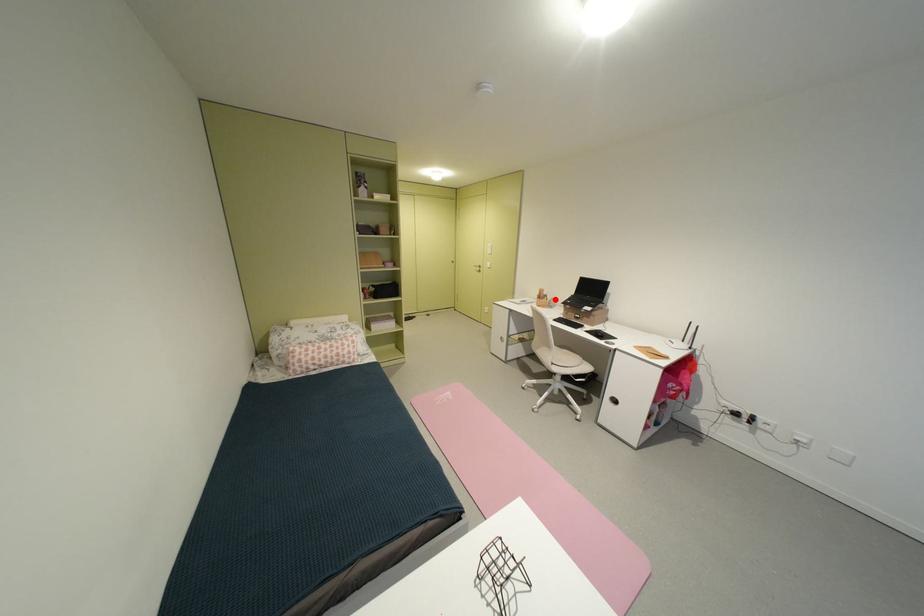
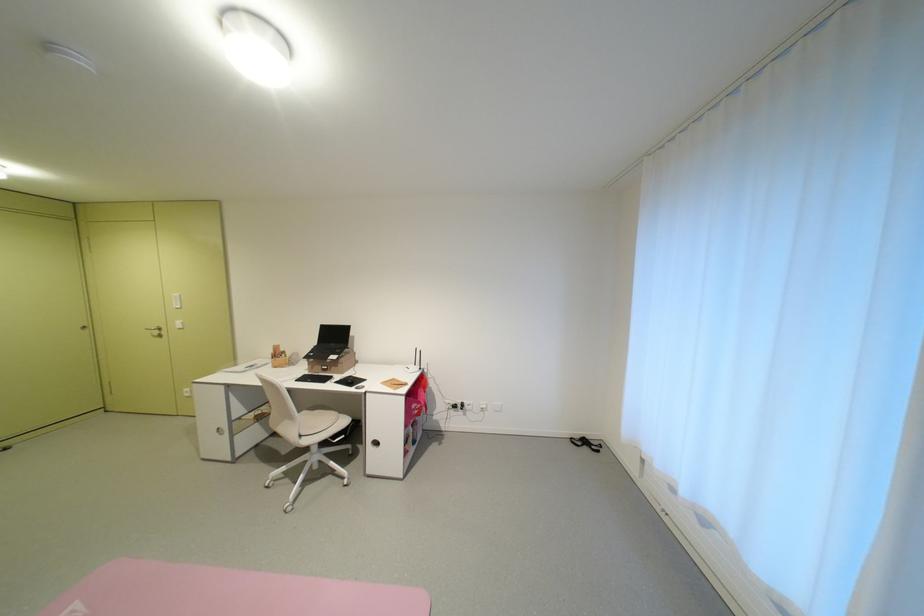
Question: I am providing you with two images of the same scene from different viewpoints. In image1, a red point is highlighted. Considering the same 3D point in image2, which of the following is correct?

Choices:
 (A) It is closer
 (B) It is farther

Answer: (B)